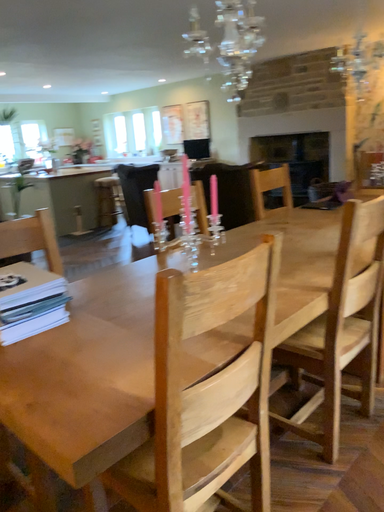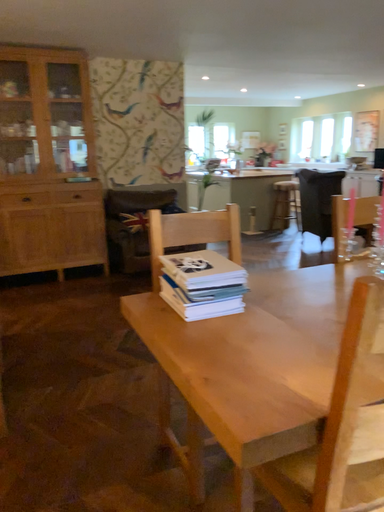
Question: Which way did the camera rotate in the video?

Choices:
 (A) rotated left
 (B) rotated right

Answer: (A)